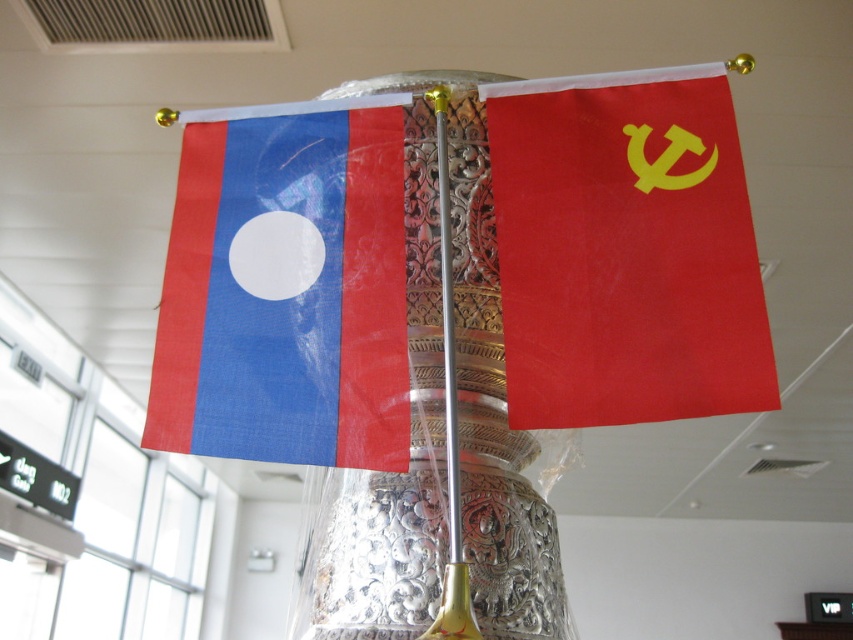
Question: Which point appears farthest from the camera in this image?

Choices:
 (A) (277, 179)
 (B) (316, 596)
 (C) (727, 212)
 (D) (465, 636)

Answer: (B)

Question: Is matte fabric flag at left below metallic polished pole at center?

Choices:
 (A) no
 (B) yes

Answer: (A)

Question: Which point is closer to the camera?

Choices:
 (A) (616, 332)
 (B) (343, 161)
 (C) (448, 192)
 (D) (369, 628)

Answer: (A)

Question: Is matte fabric flag at left to the right of silver metallic vase at center from the viewer's perspective?

Choices:
 (A) yes
 (B) no

Answer: (B)

Question: Estimate the real-world distances between objects in this image. Which object is farther from the matte fabric flag at left?

Choices:
 (A) matte fabric flag at center
 (B) silver metallic vase at center
 (C) red matte flag at upper right

Answer: (B)

Question: Is matte fabric flag at center smaller than metallic polished pole at center?

Choices:
 (A) no
 (B) yes

Answer: (A)